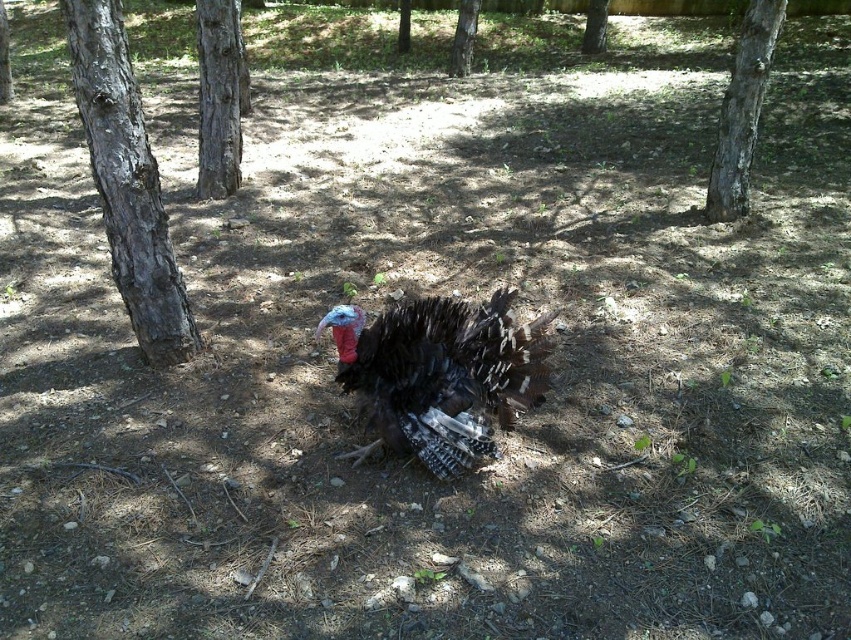
You are a bird looking for a nesting spot. You see a dark brown bark tree at left and a smooth bark tree at center. Which tree has a wider trunk for building a nest?

The dark brown bark tree at left has a wider trunk than the smooth bark tree at center, so it is better suited for building a nest.

You are a hiker who has just arrived at a forest clearing. You see a wild turkey and notice a tree with dark brown bark. According to the map, there is a hidden spring located at point (127, 182). Can you determine if the dark brown bark tree at left is the one marking the spring?

The dark brown bark tree at left is located at point (127, 182), so yes, the dark brown bark tree at left is the one marking the spring.